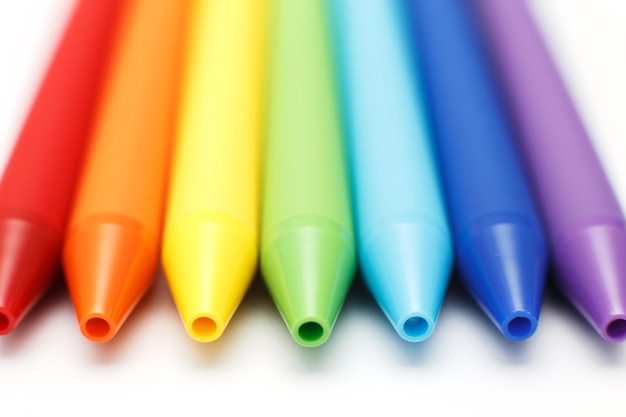
Find the location of a particular element. The image size is (626, 417). pens is located at coordinates (39, 172), (123, 177), (212, 183), (304, 179), (397, 176), (483, 169), (571, 165).